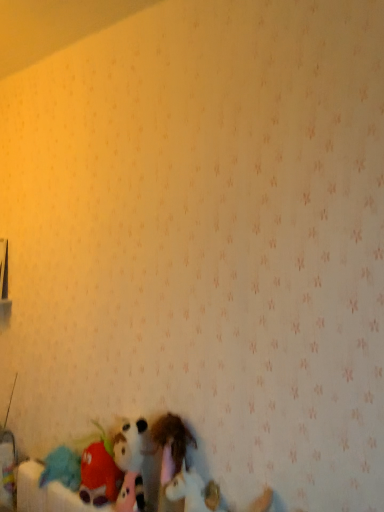
Question: Considering the positions of point (201, 508) and point (87, 461), is point (201, 508) closer or farther from the camera than point (87, 461)?

Choices:
 (A) farther
 (B) closer

Answer: (B)

Question: From the image's perspective, is white plush unicorn at lower center, the third toy from the left, located above or below fluffy plush toy at lower left, which ranks as the first toy in left-to-right order?

Choices:
 (A) above
 (B) below

Answer: (B)

Question: Considering the real-world distances, which object is farthest from the fuzzy fabric stuffed animal at lower center, the second toy viewed from the left?

Choices:
 (A) white plush unicorn at lower center, the third toy from the left
 (B) fluffy plush toy at lower left, the 3th toy from the right

Answer: (B)

Question: Which of these objects is positioned closest to the fluffy plush toy at lower left, the 3th toy from the right?

Choices:
 (A) fuzzy fabric stuffed animal at lower center, the second toy viewed from the left
 (B) white plush unicorn at lower center, which is counted as the first toy, starting from the right

Answer: (A)